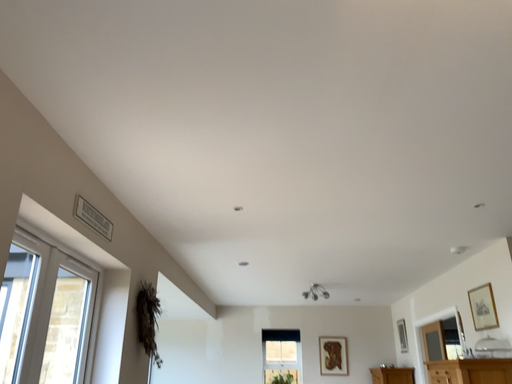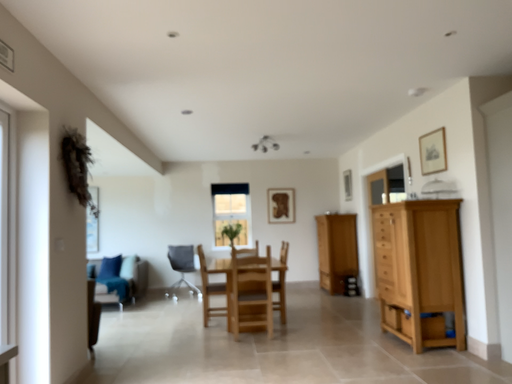
Question: Which way did the camera rotate in the video?

Choices:
 (A) rotated right
 (B) rotated left

Answer: (A)